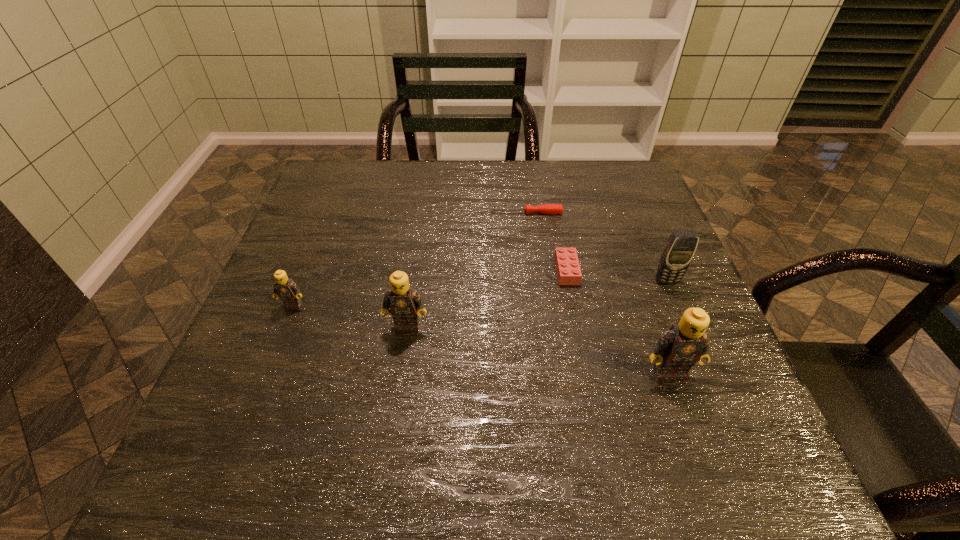
I want to click on vacant space at the far right corner of the desktop, so click(x=632, y=168).

The image size is (960, 540). Identify the location of vacant area that lies between the farthest Lego and the shortest object. (546, 241).

Image resolution: width=960 pixels, height=540 pixels. What are the coordinates of `free space between the third Lego from left to right and the leftmost Lego` in the screenshot? It's located at (430, 288).

You are a GUI agent. You are given a task and a screenshot of the screen. Output one action in this format:
    pyautogui.click(x=<x>, y=<y>)
    Task: Click on the blank region between the nearest object and the fifth farthest object
    This screenshot has width=960, height=540.
    Given the screenshot: What is the action you would take?
    pyautogui.click(x=538, y=349)

Where is `blank region between the shortest Lego and the cellular telephone`? blank region between the shortest Lego and the cellular telephone is located at coordinates (616, 276).

In order to click on vacant area between the farthest Lego and the screwdriver in this screenshot , I will do `click(546, 241)`.

The height and width of the screenshot is (540, 960). Find the location of `free area in between the fourth tallest object and the third Lego from left to right`. free area in between the fourth tallest object and the third Lego from left to right is located at coordinates (430, 288).

Identify the location of vacant space that is in between the screwdriver and the cellular telephone. (596, 247).

At what (x,y) coordinates should I click in order to perform the action: click on vacant area that lies between the shortest object and the fourth tallest object. Please return your answer as a coordinate pair (x, y). Image resolution: width=960 pixels, height=540 pixels. Looking at the image, I should click on (410, 259).

At what (x,y) coordinates should I click in order to perform the action: click on free space between the second nearest Lego and the second shortest Lego. Please return your answer as a coordinate pair (x, y). Looking at the image, I should click on (350, 315).